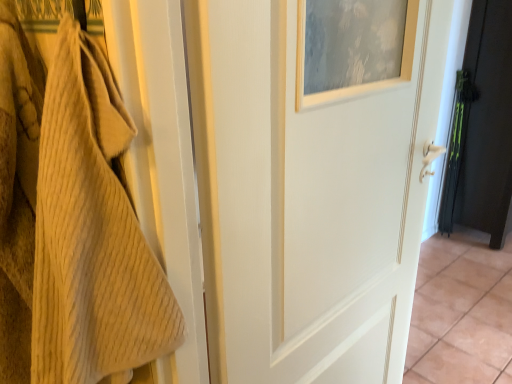
Question: Would you consider white painted wood door at center, the 1th door from the front, to be distant from white glossy tile at center?

Choices:
 (A) yes
 (B) no

Answer: (A)

Question: Is white painted wood door at center, the 2th door in the right-to-left sequence, closer to the viewer compared to white glossy tile at center?

Choices:
 (A) yes
 (B) no

Answer: (A)

Question: Does white painted wood door at center, which ranks as the 1th door in left-to-right order, have a greater height compared to white glossy tile at center?

Choices:
 (A) no
 (B) yes

Answer: (B)

Question: From the image's perspective, is white painted wood door at center, which ranks as the 1th door in left-to-right order, beneath white glossy tile at center?

Choices:
 (A) yes
 (B) no

Answer: (B)

Question: Considering the relative sizes of white painted wood door at center, the 2th door in the right-to-left sequence, and white glossy tile at center in the image provided, is white painted wood door at center, the 2th door in the right-to-left sequence, smaller than white glossy tile at center?

Choices:
 (A) yes
 (B) no

Answer: (B)

Question: Considering the relative sizes of white painted wood door at center, the second door positioned from the back, and white glossy tile at center in the image provided, is white painted wood door at center, the second door positioned from the back, shorter than white glossy tile at center?

Choices:
 (A) no
 (B) yes

Answer: (A)

Question: Can you confirm if black matte door at right, the first door when ordered from back to front, is positioned to the right of white painted wood door at center, which ranks as the 1th door in left-to-right order?

Choices:
 (A) yes
 (B) no

Answer: (A)

Question: Can you confirm if black matte door at right, which appears as the second door when viewed from the front, is smaller than white painted wood door at center, the second door positioned from the back?

Choices:
 (A) no
 (B) yes

Answer: (A)

Question: Does black matte door at right, which appears as the second door when viewed from the front, appear on the left side of white painted wood door at center, the 1th door from the front?

Choices:
 (A) no
 (B) yes

Answer: (A)

Question: From the image's perspective, is black matte door at right, arranged as the first door when viewed from the right, over white painted wood door at center, the 1th door from the front?

Choices:
 (A) no
 (B) yes

Answer: (B)

Question: Is black matte door at right, the first door when ordered from back to front, surrounding white painted wood door at center, the 1th door from the front?

Choices:
 (A) no
 (B) yes

Answer: (A)

Question: Is black matte door at right, which appears as the second door when viewed from the front, closer to camera compared to white painted wood door at center, the 2th door in the right-to-left sequence?

Choices:
 (A) no
 (B) yes

Answer: (A)

Question: Is white glossy tile at center not close to black matte door at right, arranged as the first door when viewed from the right?

Choices:
 (A) yes
 (B) no

Answer: (B)